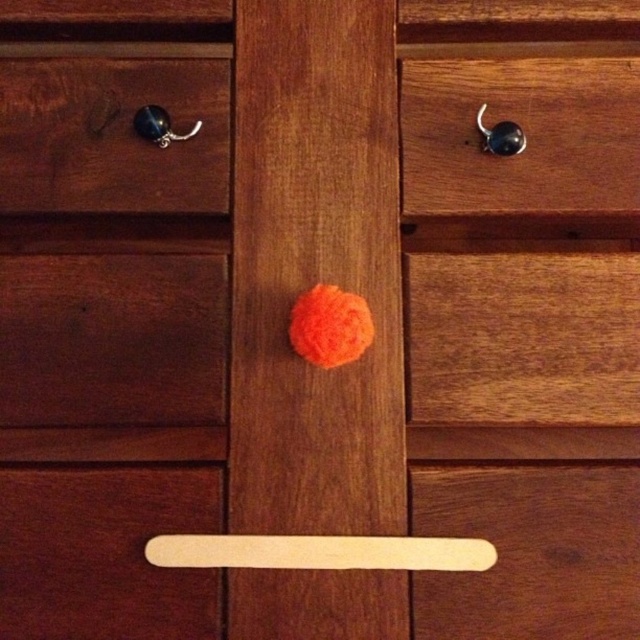
Question: Does dark brown wood at lower left appear on the right side of matte black knob at upper right?

Choices:
 (A) yes
 (B) no

Answer: (B)

Question: Which point appears closest to the camera in this image?

Choices:
 (A) (168, 577)
 (B) (550, 122)
 (C) (97, 420)

Answer: (A)

Question: Which point appears closest to the camera in this image?

Choices:
 (A) (64, 611)
 (B) (422, 182)

Answer: (A)

Question: Is the position of wooden stick at lower center less distant than that of matte black knob at upper left?

Choices:
 (A) yes
 (B) no

Answer: (A)

Question: Is wooden stick at lower center to the left of metallic hook at upper right from the viewer's perspective?

Choices:
 (A) no
 (B) yes

Answer: (A)

Question: Which point is farther to the camera?

Choices:
 (A) metallic hook at upper left
 (B) metallic hook at upper right

Answer: (A)